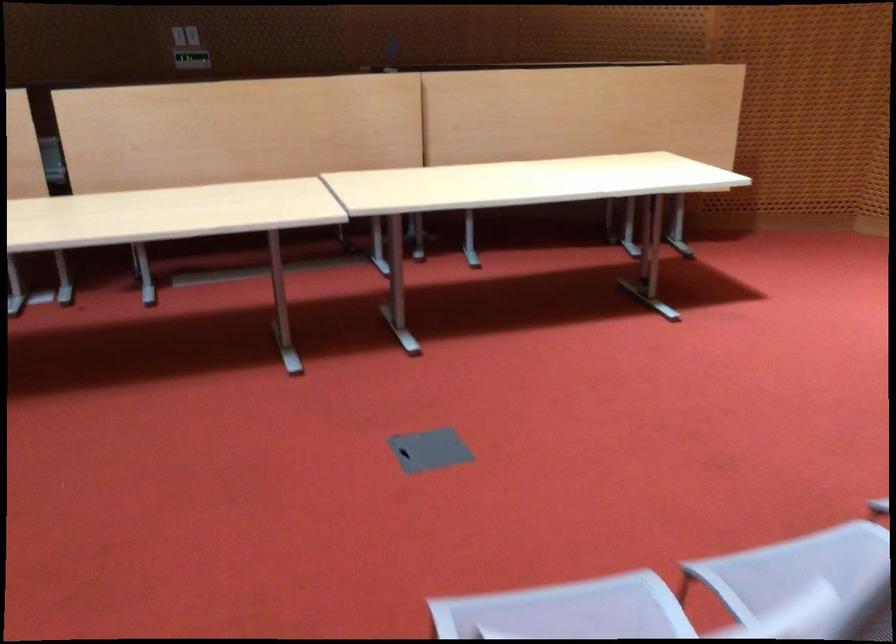
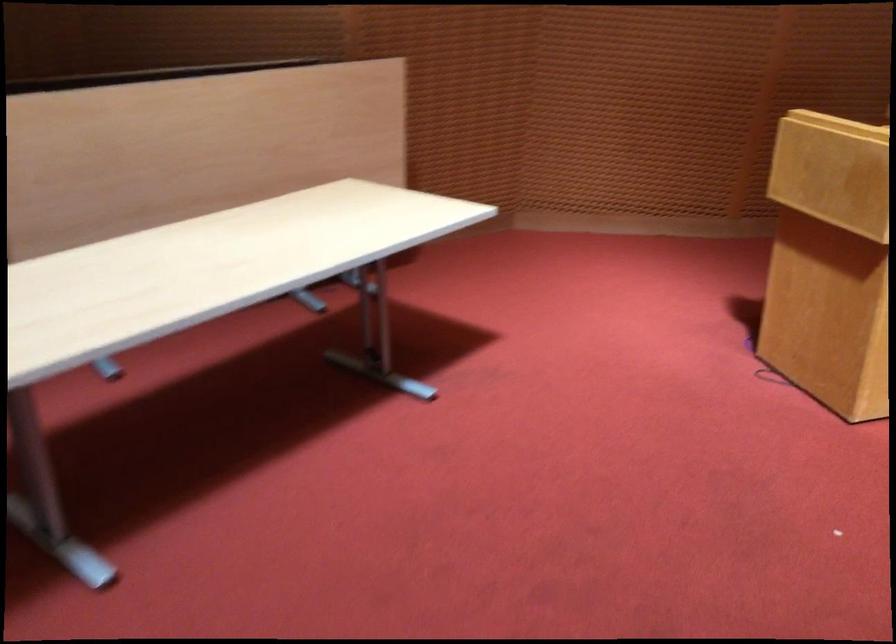
Question: What movement of the cameraman would produce the second image?

Choices:
 (A) Left
 (B) Right
 (C) Forward
 (D) Backward

Answer: (D)